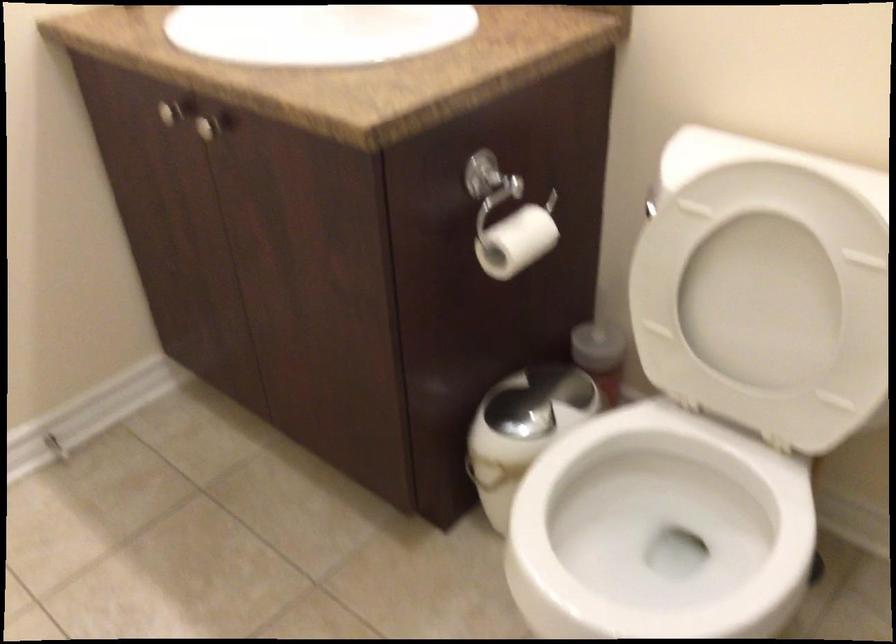
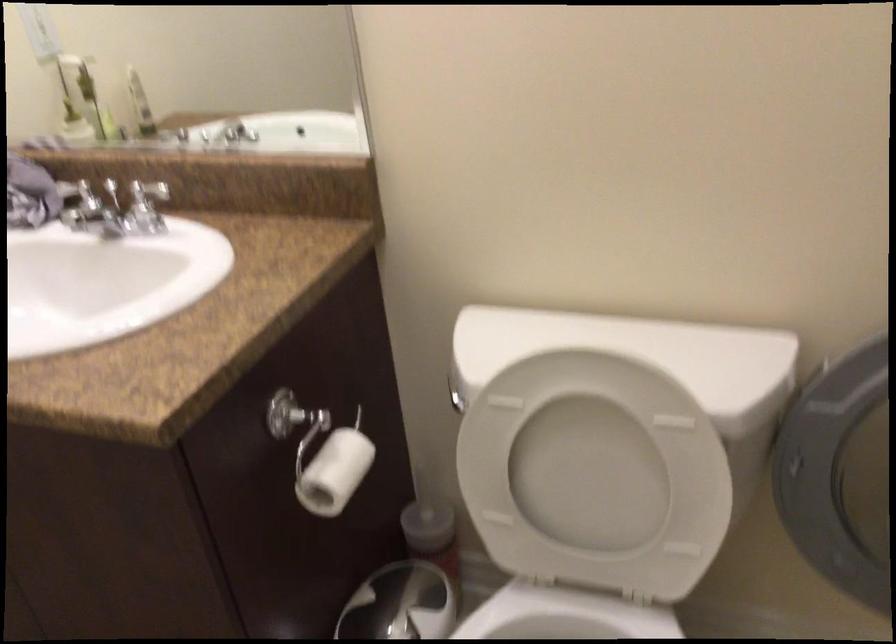
Question: The camera is either moving clockwise (left) or counter-clockwise (right) around the object. The first image is from the beginning of the video and the second image is from the end. Is the camera moving left or right when shooting the video?

Choices:
 (A) Left
 (B) Right

Answer: (A)